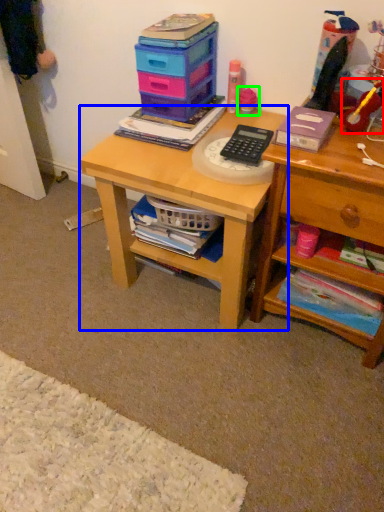
Question: Estimate the real-world distances between objects in this image. Which object is closer to toy (highlighted by a red box), desk (highlighted by a blue box) or toy (highlighted by a green box)?

Choices:
 (A) desk
 (B) toy

Answer: (B)